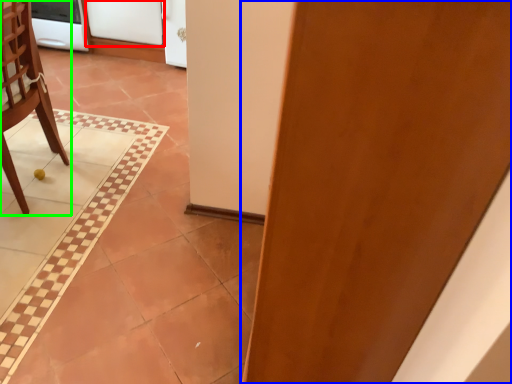
Question: Estimate the real-world distances between objects in this image. Which object is closer to screen door (highlighted by a red box), door (highlighted by a blue box) or chair (highlighted by a green box)?

Choices:
 (A) door
 (B) chair

Answer: (B)